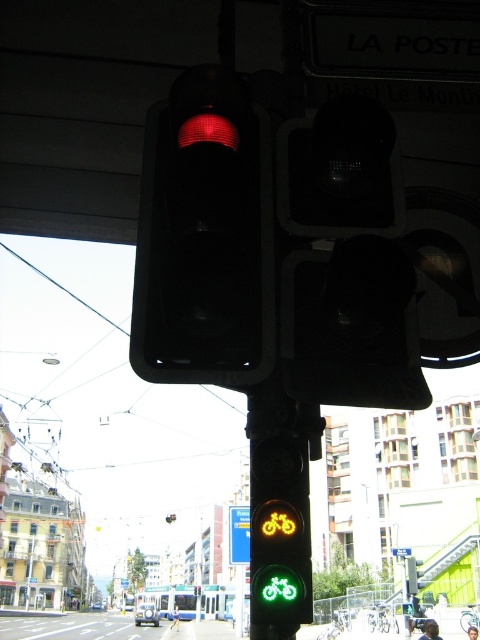
You are a city planner reviewing the traffic light system. You notice the matte black traffic light at upper center and the blue plastic road sign at upper center. Given their distance apart, would they interfere with each other in terms of visibility for drivers?

The matte black traffic light at upper center and blue plastic road sign at upper center are 365.89 feet apart, so they are far enough apart to avoid visibility interference for drivers.

You are a city planner reviewing the layout of this intersection. The traffic light at the intersection is located at coordinates 0.372, 0.427. If you wanted to install a new pedestrian crossing sign that must be placed exactly 0.1 units to the right of the matte black traffic light at upper center, what would be the new coordinates for the sign?

The new coordinates for the pedestrian crossing sign would be calculated by adding 0.1 to the x coordinate of the matte black traffic light at upper center. The original coordinates are (204, 237). Adding 0.1 to the x value gives 0.472, so the new coordinates are (204, 301).

You are a pedestrian waiting at the intersection. You see the matte red traffic light at upper center and the green glass bicycle at center. Which one is positioned higher in the image?

The matte red traffic light at upper center is located above the green glass bicycle at center, so it is positioned higher in the image.